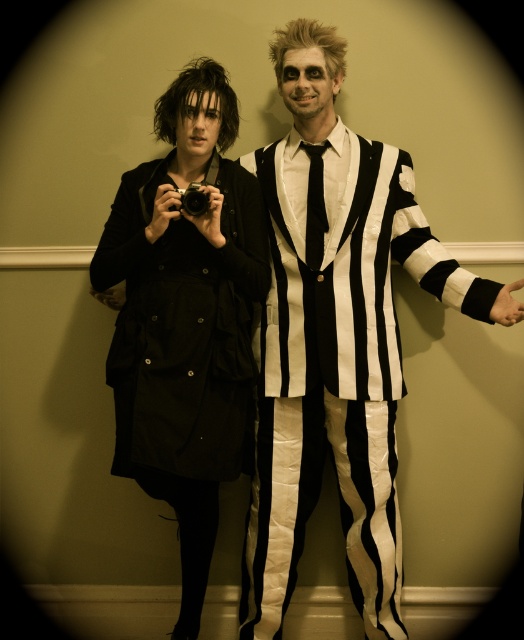
From the picture: You are a photographer trying to decide where to place a new tripod in the scene. The tripod requires a space wider than the black plastic camera at center. Can the space next to the black matte coat at left accommodate the tripod?

The black matte coat at left is wider than the black plastic camera at center, so the space next to the black matte coat at left is wider than needed for the tripod. Therefore, the tripod can be placed there.

You are a photographer trying to capture the person in the black plastic camera at center. Since the black matte coat at left is blocking your view, can you move to the side to get a clear shot?

The black matte coat at left is in front of the black plastic camera at center, so moving to the side might allow you to see around the black matte coat at left and get a clear shot of the black plastic camera at center.

You are a photographer standing 1.5 meters away from the camera. You want to take a photo of the black matte coat at left without moving closer. Is the current distance sufficient?

The black matte coat at left is 1.74 meters away from the camera. Since you are standing 1.5 meters away from the camera, you are closer than the coat, so you can take the photo without moving closer.